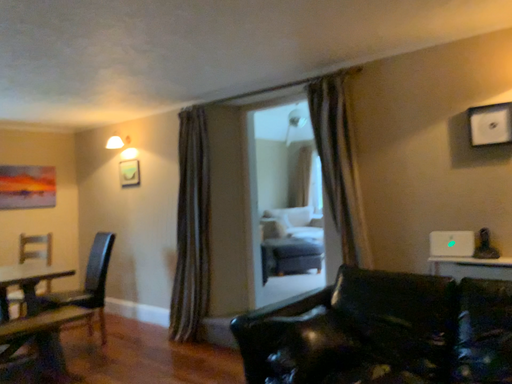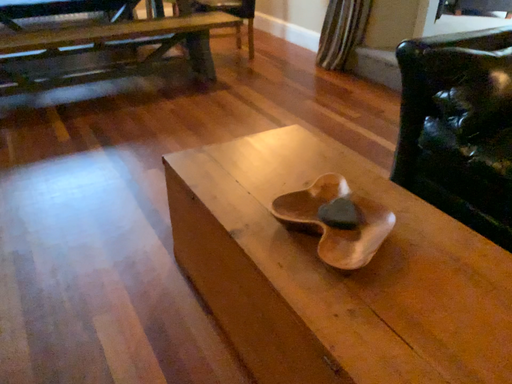
Question: Which way did the camera rotate in the video?

Choices:
 (A) rotated right
 (B) rotated left

Answer: (B)